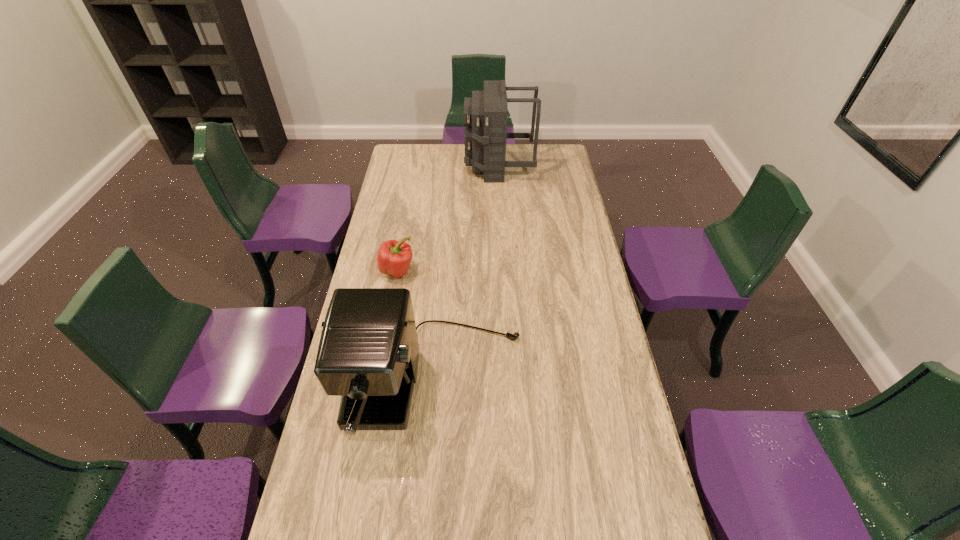
This screenshot has height=540, width=960. Identify the location of object that is the second closest one to the backpack. (368, 354).

Locate which object is the closest to the shortest object. Please provide its 2D coordinates. Your answer should be formatted as a tuple, i.e. [(x, y)], where the tuple contains the x and y coordinates of a point satisfying the conditions above.

[(368, 354)]

Where is `vacant area that satisfies the following two spatial constraints: 1. on the front compartment of the backpack; 2. on the front-facing side of the nearest object`? vacant area that satisfies the following two spatial constraints: 1. on the front compartment of the backpack; 2. on the front-facing side of the nearest object is located at coordinates (511, 381).

The height and width of the screenshot is (540, 960). Find the location of `blank area in the image that satisfies the following two spatial constraints: 1. on the front compartment of the tallest object; 2. on the front side of the second nearest object`. blank area in the image that satisfies the following two spatial constraints: 1. on the front compartment of the tallest object; 2. on the front side of the second nearest object is located at coordinates (504, 271).